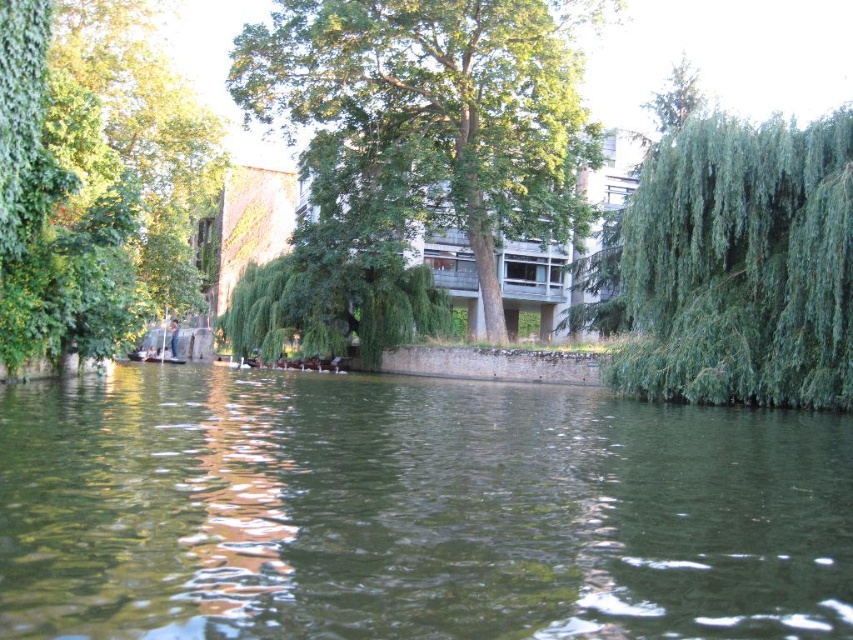
Question: Does green leafy tree at left have a greater width compared to green leafy willow at right?

Choices:
 (A) no
 (B) yes

Answer: (B)

Question: Which is farther from the green leafy tree at center?

Choices:
 (A) greenish water at center
 (B) green leafy willow at center
 (C) green leafy willow at right
 (D) green leafy tree at left

Answer: (A)

Question: Can you confirm if green leafy tree at left is bigger than green leafy tree at center?

Choices:
 (A) yes
 (B) no

Answer: (B)

Question: Which object is positioned farthest from the green leafy tree at center?

Choices:
 (A) green leafy willow at right
 (B) green leafy tree at left

Answer: (A)

Question: Among these points, which one is nearest to the camera?

Choices:
 (A) (544, 64)
 (B) (407, 282)
 (C) (74, 104)
 (D) (784, 337)

Answer: (D)

Question: Is green leafy tree at center to the left of green leafy willow at center from the viewer's perspective?

Choices:
 (A) no
 (B) yes

Answer: (A)